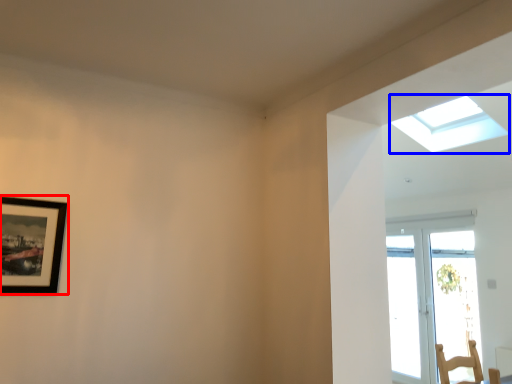
Question: Which of the following is the farthest to the observer, picture frame (highlighted by a red box) or window (highlighted by a blue box)?

Choices:
 (A) picture frame
 (B) window

Answer: (B)